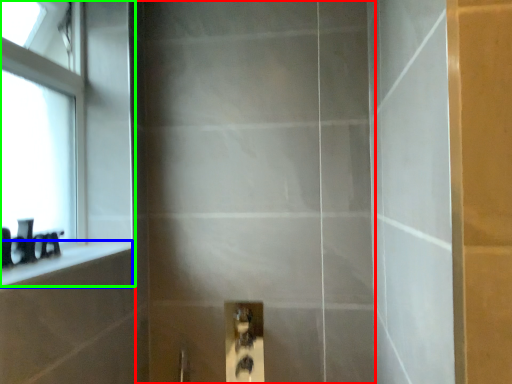
Question: Which object is the farthest from screen door (highlighted by a red box)? Choose among these: ledge (highlighted by a blue box) or window (highlighted by a green box).

Choices:
 (A) ledge
 (B) window

Answer: (A)